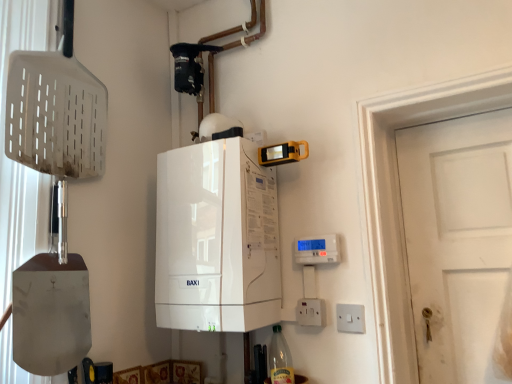
Describe the element at coordinates (216, 239) in the screenshot. I see `white glossy boiler at center` at that location.

This screenshot has height=384, width=512. In order to click on white plastic switch at lower right, which is the second electric outlet from left to right in this screenshot , I will do `click(350, 318)`.

What do you see at coordinates (350, 318) in the screenshot?
I see `white plastic switch at lower right, placed as the first electric outlet when sorted from right to left` at bounding box center [350, 318].

What is the approximate height of white plastic electric outlet at lower right, which is the 2th electric outlet from right to left?

3.80 inches.

Locate an element on the screen. This screenshot has height=384, width=512. white glossy boiler at center is located at coordinates (216, 239).

I want to click on home appliance that appears above the white plastic switch at lower right, placed as the first electric outlet when sorted from right to left (from the image's perspective), so click(x=216, y=239).

Is white plastic switch at lower right, which is the second electric outlet from left to right, next to white glossy boiler at center and touching it?

They are not placed beside each other.

Looking at this image, is white plastic switch at lower right, placed as the first electric outlet when sorted from right to left, surrounding white glossy boiler at center?

No, white plastic switch at lower right, placed as the first electric outlet when sorted from right to left, does not contain white glossy boiler at center.

From a real-world perspective, is white plastic switch at lower right, which is the second electric outlet from left to right, below white glossy boiler at center?

Yes, from a real-world perspective, white plastic switch at lower right, which is the second electric outlet from left to right, is under white glossy boiler at center.

Looking at this image, between white glossy boiler at center and white plastic electric outlet at lower right, which is the 1th electric outlet from left to right, which one is positioned in front?

white glossy boiler at center is closer to the camera.

Which is more to the right, white glossy boiler at center or white plastic electric outlet at lower right, which is the 2th electric outlet from right to left?

white plastic electric outlet at lower right, which is the 2th electric outlet from right to left.

From the image's perspective, would you say white glossy boiler at center is positioned over white plastic electric outlet at lower right, which is the 1th electric outlet from left to right?

Yes, from the image's perspective, white glossy boiler at center is on top of white plastic electric outlet at lower right, which is the 1th electric outlet from left to right.

Does white glossy boiler at center have a lesser height compared to white plastic electric outlet at lower right, which is the 1th electric outlet from left to right?

No.

Find the location of `home appliance lying above the clear glass bottle at lower center (from the image's perspective)`. home appliance lying above the clear glass bottle at lower center (from the image's perspective) is located at coordinates (216, 239).

How many degrees apart are the facing directions of clear glass bottle at lower center and white glossy boiler at center?

The angle between the facing direction of clear glass bottle at lower center and the facing direction of white glossy boiler at center is 90 degrees.

Who is bigger, clear glass bottle at lower center or white glossy boiler at center?

white glossy boiler at center is bigger.

Is clear glass bottle at lower center completely or partially outside of white glossy boiler at center?

clear glass bottle at lower center lies outside white glossy boiler at center's area.

Considering the sizes of white glossy boiler at center and white plastic switch at lower right, placed as the first electric outlet when sorted from right to left, in the image, is white glossy boiler at center wider or thinner than white plastic switch at lower right, placed as the first electric outlet when sorted from right to left,?

In the image, white glossy boiler at center appears to be wider than white plastic switch at lower right, placed as the first electric outlet when sorted from right to left.

Does white glossy boiler at center come behind white plastic switch at lower right, placed as the first electric outlet when sorted from right to left?

No, it is not.

This screenshot has width=512, height=384. I want to click on home appliance above the white plastic switch at lower right, which is the second electric outlet from left to right (from a real-world perspective), so click(216, 239).

Considering their positions, is clear glass bottle at lower center located in front of or behind white plastic electric outlet at lower right, which is the 2th electric outlet from right to left?

Clearly, clear glass bottle at lower center is in front of white plastic electric outlet at lower right, which is the 2th electric outlet from right to left.

Is clear glass bottle at lower center aimed at white plastic electric outlet at lower right, which is the 2th electric outlet from right to left?

No, clear glass bottle at lower center does not turn towards white plastic electric outlet at lower right, which is the 2th electric outlet from right to left.

Could white plastic electric outlet at lower right, which is the 1th electric outlet from left to right, be considered to be inside clear glass bottle at lower center?

No, white plastic electric outlet at lower right, which is the 1th electric outlet from left to right, is not inside clear glass bottle at lower center.

Considering the relative sizes of white plastic switch at lower right, placed as the first electric outlet when sorted from right to left, and clear glass bottle at lower center in the image provided, is white plastic switch at lower right, placed as the first electric outlet when sorted from right to left, taller than clear glass bottle at lower center?

Incorrect, the height of white plastic switch at lower right, placed as the first electric outlet when sorted from right to left, is not larger of that of clear glass bottle at lower center.

From a real-world perspective, relative to clear glass bottle at lower center, is white plastic switch at lower right, placed as the first electric outlet when sorted from right to left, vertically above or below?

white plastic switch at lower right, placed as the first electric outlet when sorted from right to left, is above clear glass bottle at lower center.

Considering the sizes of objects white plastic switch at lower right, placed as the first electric outlet when sorted from right to left, and clear glass bottle at lower center in the image provided, who is wider, white plastic switch at lower right, placed as the first electric outlet when sorted from right to left, or clear glass bottle at lower center?

Wider between the two is clear glass bottle at lower center.

Measure the distance between white plastic switch at lower right, placed as the first electric outlet when sorted from right to left, and clear glass bottle at lower center.

The distance of white plastic switch at lower right, placed as the first electric outlet when sorted from right to left, from clear glass bottle at lower center is 10.07 inches.

In terms of height, does white plastic electric outlet at lower right, which is the 2th electric outlet from right to left, look taller or shorter compared to white plastic switch at lower right, which is the second electric outlet from left to right?

Considering their sizes, white plastic electric outlet at lower right, which is the 2th electric outlet from right to left, has more height than white plastic switch at lower right, which is the second electric outlet from left to right.

Considering the positions of point (311, 301) and point (338, 329), is point (311, 301) closer or farther from the camera than point (338, 329)?

Point (311, 301) is positioned farther from the camera compared to point (338, 329).

This screenshot has height=384, width=512. Identify the location of electric outlet above the white plastic switch at lower right, which is the second electric outlet from left to right (from the image's perspective). (310, 312).

Can you confirm if white plastic electric outlet at lower right, which is the 1th electric outlet from left to right, is thinner than white plastic switch at lower right, placed as the first electric outlet when sorted from right to left?

In fact, white plastic electric outlet at lower right, which is the 1th electric outlet from left to right, might be wider than white plastic switch at lower right, placed as the first electric outlet when sorted from right to left.

Find the location of a particular element. home appliance positioned vertically above the white plastic switch at lower right, which is the second electric outlet from left to right (from a real-world perspective) is located at coordinates (216, 239).

You are a GUI agent. You are given a task and a screenshot of the screen. Output one action in this format:
    pyautogui.click(x=<x>, y=<y>)
    Task: Click on the home appliance located on the left of white plastic electric outlet at lower right, which is the 2th electric outlet from right to left
    
    Given the screenshot: What is the action you would take?
    pyautogui.click(x=216, y=239)

Considering their positions, is white glossy boiler at center positioned closer to white plastic electric outlet at lower right, which is the 1th electric outlet from left to right, than clear glass bottle at lower center?

clear glass bottle at lower center lies closer to white plastic electric outlet at lower right, which is the 1th electric outlet from left to right, than the other object.

Considering their positions, is white plastic switch at lower right, which is the second electric outlet from left to right, positioned closer to white glossy boiler at center than white plastic electric outlet at lower right, which is the 2th electric outlet from right to left?

white plastic electric outlet at lower right, which is the 2th electric outlet from right to left.

Looking at this image, looking at the image, which one is located further to white glossy boiler at center, white plastic electric outlet at lower right, which is the 1th electric outlet from left to right, or white plastic switch at lower right, which is the second electric outlet from left to right?

white plastic switch at lower right, which is the second electric outlet from left to right, is further to white glossy boiler at center.

From the picture: Based on their spatial positions, is white plastic electric outlet at lower right, which is the 1th electric outlet from left to right, or white glossy boiler at center further from clear glass bottle at lower center?

white glossy boiler at center.

When comparing their distances from white plastic switch at lower right, which is the second electric outlet from left to right, does clear glass bottle at lower center or white glossy boiler at center seem closer?

clear glass bottle at lower center is positioned closer to the anchor white plastic switch at lower right, which is the second electric outlet from left to right.

Which object lies nearer to the anchor point white glossy boiler at center, clear glass bottle at lower center or white plastic switch at lower right, placed as the first electric outlet when sorted from right to left?

The object closer to white glossy boiler at center is clear glass bottle at lower center.

From the image, which object appears to be farther from white plastic electric outlet at lower right, which is the 2th electric outlet from right to left, white plastic switch at lower right, placed as the first electric outlet when sorted from right to left, or clear glass bottle at lower center?

Among the two, clear glass bottle at lower center is located further to white plastic electric outlet at lower right, which is the 2th electric outlet from right to left.

Estimate the real-world distances between objects in this image. Which object is further from clear glass bottle at lower center, white glossy boiler at center or white plastic switch at lower right, which is the second electric outlet from left to right?

Based on the image, white glossy boiler at center appears to be further to clear glass bottle at lower center.

The image size is (512, 384). I want to click on electric outlet between clear glass bottle at lower center and white plastic switch at lower right, placed as the first electric outlet when sorted from right to left, from left to right, so click(310, 312).

At what (x,y) coordinates should I click in order to perform the action: click on electric outlet located between white glossy boiler at center and white plastic switch at lower right, which is the second electric outlet from left to right, in the left-right direction. Please return your answer as a coordinate pair (x, y). The image size is (512, 384). Looking at the image, I should click on (310, 312).

Locate an element on the screen. This screenshot has width=512, height=384. bottle between white glossy boiler at center and white plastic switch at lower right, which is the second electric outlet from left to right is located at coordinates (280, 359).